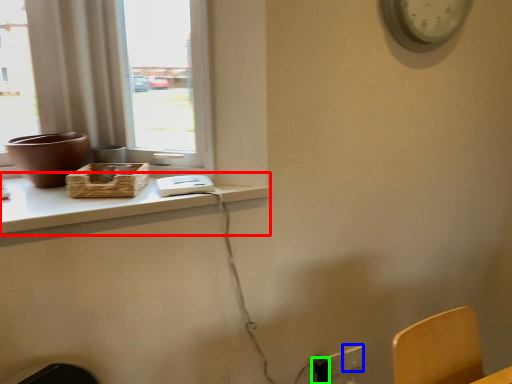
Question: Which object is positioned closest to computer desk (highlighted by a red box)? Select from electric outlet (highlighted by a blue box) and electric outlet (highlighted by a green box).

Choices:
 (A) electric outlet
 (B) electric outlet

Answer: (B)